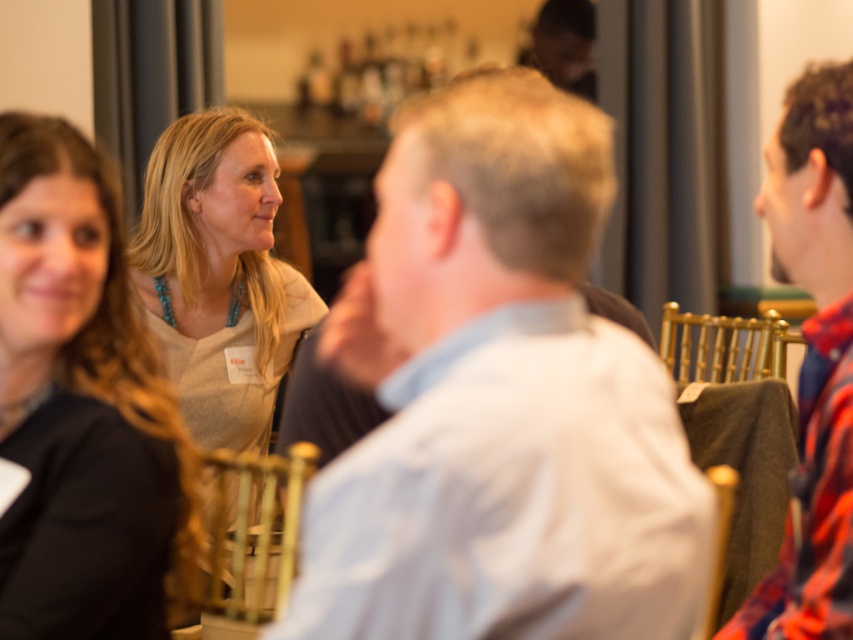
Question: Which object is the closest to the light beige sweater at center?

Choices:
 (A) light blue shirt at center
 (B) matte gray sweater at upper left
 (C) flannel shirt at right

Answer: (B)

Question: Among these points, which one is farthest from the camera?

Choices:
 (A) (850, 346)
 (B) (572, 424)

Answer: (A)

Question: Can you confirm if matte gray sweater at upper left is positioned to the left of flannel shirt at right?

Choices:
 (A) no
 (B) yes

Answer: (B)

Question: Observing the image, what is the correct spatial positioning of light blue shirt at center in reference to flannel shirt at right?

Choices:
 (A) below
 (B) above

Answer: (A)

Question: Which point is farther to the camera?

Choices:
 (A) light blue shirt at center
 (B) light beige sweater at center
 (C) flannel shirt at right
 (D) matte gray sweater at upper left

Answer: (B)

Question: Does light beige sweater at center appear on the right side of flannel shirt at right?

Choices:
 (A) no
 (B) yes

Answer: (A)